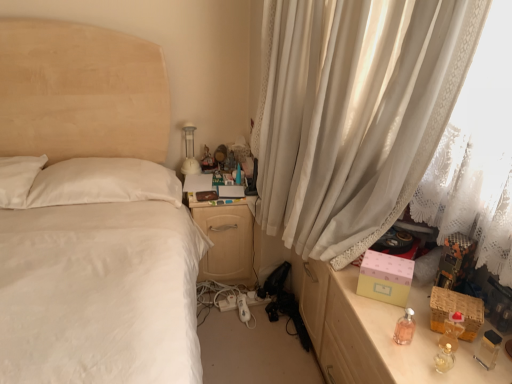
Locate an element on the screen. Image resolution: width=512 pixels, height=384 pixels. vacant space behind translucent amber bottle at right, which is the first perfume from right to left is located at coordinates (415, 308).